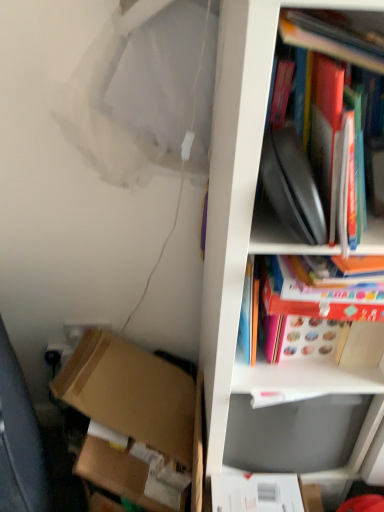
Question: From the image's perspective, relative to matte red book at upper right, which appears as the first book when ordered from the bottom, is brown cardboard box at lower left above or below?

Choices:
 (A) above
 (B) below

Answer: (B)

Question: Do you think brown cardboard box at lower left is within matte red book at upper right, the 2th book positioned from the top, or outside of it?

Choices:
 (A) inside
 (B) outside

Answer: (B)

Question: Which is farther from the hardcover book at upper right, positioned as the first book in top-to-bottom order?

Choices:
 (A) white matte cabinet at right
 (B) brown cardboard box at lower left
 (C) matte red book at upper right, the 2th book positioned from the top

Answer: (B)

Question: Which of these objects is positioned closest to the hardcover book at upper right, positioned as the first book in top-to-bottom order?

Choices:
 (A) matte red book at upper right, which appears as the first book when ordered from the bottom
 (B) brown cardboard box at lower left
 (C) white matte cabinet at right

Answer: (C)